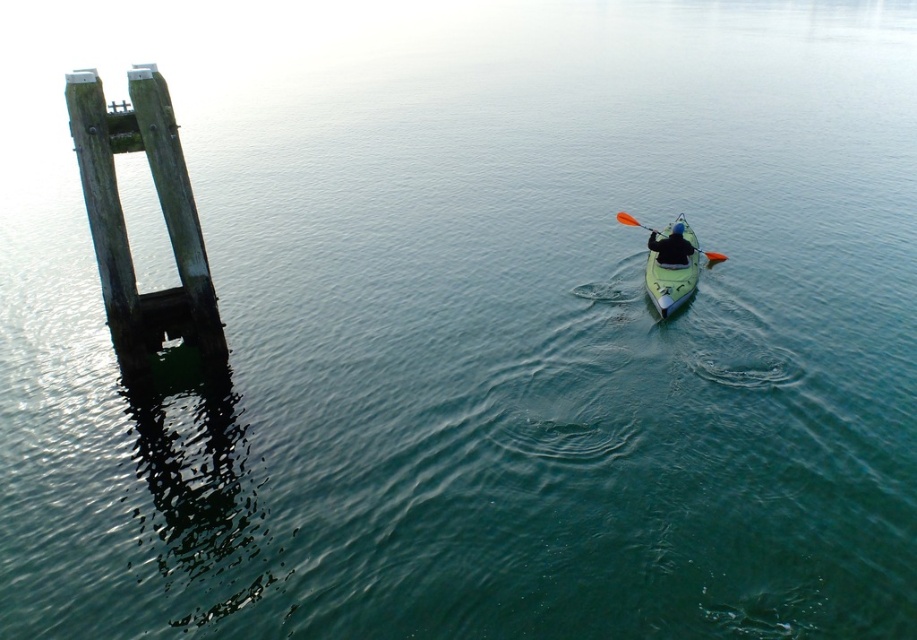
Based on the photo, you are a photographer positioned at the camera location. You want to capture a closeup shot of the weathered wood dock at left. Given that your telephoto lens can focus on objects up to 15 meters away, will you be able to take the photo without moving closer?

The distance between the weathered wood dock at left and the camera is 16.40 meters, which exceeds the telephoto lens maximum focus range of 15 meters. Therefore, you cannot take the photo without moving closer.